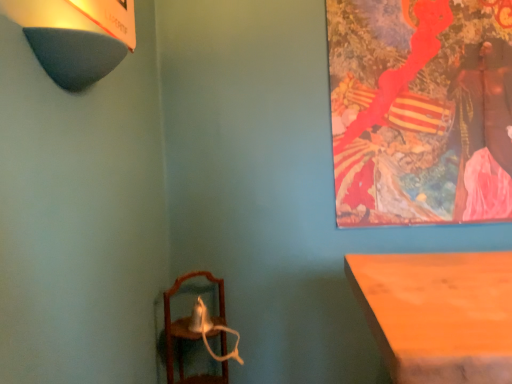
Question: Is painted canvas at upper right to the right of dark gray felt lampshade at upper left from the viewer's perspective?

Choices:
 (A) no
 (B) yes

Answer: (B)

Question: Is painted canvas at upper right aimed at dark gray felt lampshade at upper left?

Choices:
 (A) yes
 (B) no

Answer: (B)

Question: Is painted canvas at upper right to the left of dark gray felt lampshade at upper left from the viewer's perspective?

Choices:
 (A) yes
 (B) no

Answer: (B)

Question: Does painted canvas at upper right have a lesser height compared to dark gray felt lampshade at upper left?

Choices:
 (A) yes
 (B) no

Answer: (B)

Question: Is painted canvas at upper right in front of dark gray felt lampshade at upper left?

Choices:
 (A) no
 (B) yes

Answer: (A)

Question: Based on their positions, is wooden mirror at lower left located to the left or right of dark gray felt lampshade at upper left?

Choices:
 (A) left
 (B) right

Answer: (B)

Question: From a real-world perspective, is wooden mirror at lower left positioned above or below dark gray felt lampshade at upper left?

Choices:
 (A) above
 (B) below

Answer: (B)

Question: Does point (205, 380) appear closer or farther from the camera than point (49, 61)?

Choices:
 (A) farther
 (B) closer

Answer: (A)

Question: From their relative heights in the image, would you say wooden mirror at lower left is taller or shorter than dark gray felt lampshade at upper left?

Choices:
 (A) tall
 (B) short

Answer: (A)

Question: From their relative heights in the image, would you say wooden mirror at lower left is taller or shorter than painted canvas at upper right?

Choices:
 (A) tall
 (B) short

Answer: (B)

Question: From a real-world perspective, is wooden mirror at lower left above or below painted canvas at upper right?

Choices:
 (A) above
 (B) below

Answer: (B)

Question: Is wooden mirror at lower left wider or thinner than painted canvas at upper right?

Choices:
 (A) thin
 (B) wide

Answer: (B)

Question: Visually, is wooden mirror at lower left positioned to the left or to the right of painted canvas at upper right?

Choices:
 (A) left
 (B) right

Answer: (A)

Question: Considering their positions, is dark gray felt lampshade at upper left located in front of or behind painted canvas at upper right?

Choices:
 (A) front
 (B) behind

Answer: (A)

Question: From their relative heights in the image, would you say dark gray felt lampshade at upper left is taller or shorter than painted canvas at upper right?

Choices:
 (A) tall
 (B) short

Answer: (B)